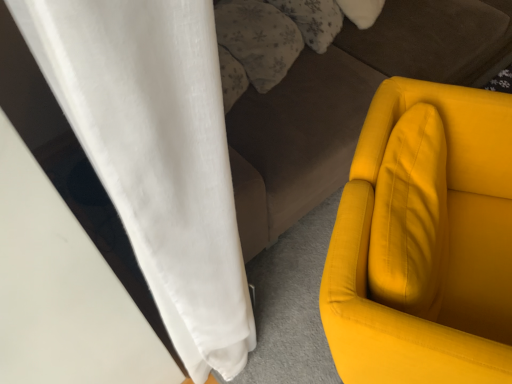
Question: Is matte yellow armchair at right to the left or to the right of fluffy white pillow at upper center, which is the second pillow in left-to-right order, in the image?

Choices:
 (A) left
 (B) right

Answer: (B)

Question: Considering the positions of point (423, 94) and point (288, 8), is point (423, 94) closer or farther from the camera than point (288, 8)?

Choices:
 (A) farther
 (B) closer

Answer: (B)

Question: Which of these objects is positioned closest to the fluffy white pillow at upper center, positioned as the first pillow in right-to-left order?

Choices:
 (A) velvet brown studio couch at center
 (B) matte yellow armchair at right
 (C) fluffy white pillow at upper center, the 1th pillow in the left-to-right sequence

Answer: (C)

Question: Which object is the farthest from the fluffy white pillow at upper center, positioned as the 2th pillow in right-to-left order?

Choices:
 (A) fluffy white pillow at upper center, which is the second pillow in left-to-right order
 (B) velvet brown studio couch at center
 (C) matte yellow armchair at right

Answer: (C)